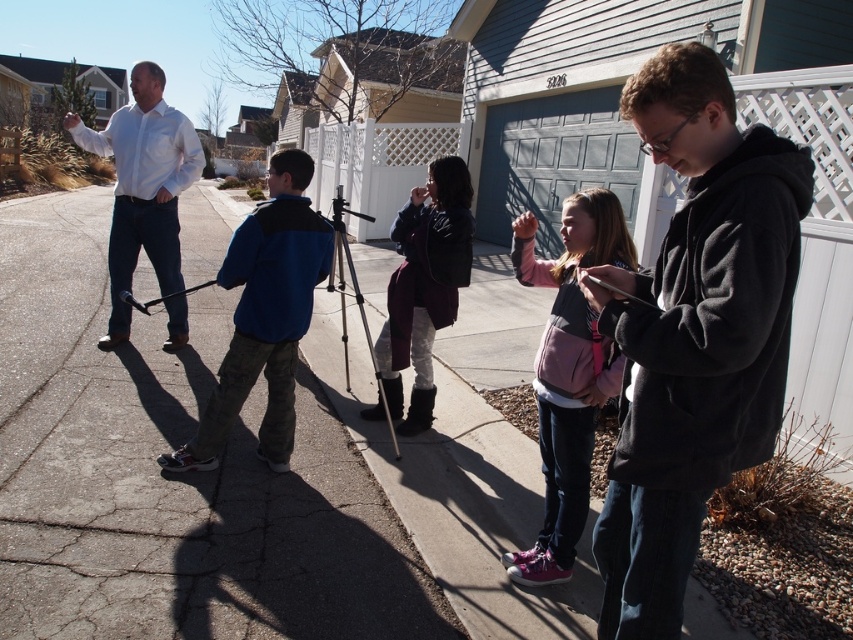
Is point (16, 352) more distant than point (598, 620)?

Yes, it is behind point (598, 620).

Does concrete sidewalk at center appear on the left side of dark gray fleece jacket at center right?

Yes, concrete sidewalk at center is to the left of dark gray fleece jacket at center right.

Is point (94, 378) less distant than point (740, 358)?

No, it is not.

You are a GUI agent. You are given a task and a screenshot of the screen. Output one action in this format:
    pyautogui.click(x=<x>, y=<y>)
    Task: Click on the concrete sidewalk at center
    
    Given the screenshot: What is the action you would take?
    pyautogui.click(x=170, y=477)

Is concrete sidewalk at center positioned at the back of camouflage pants at left?

That is False.

Who is more forward, (132, 568) or (265, 336)?

Positioned in front is point (132, 568).

Locate an element on the screen. The image size is (853, 640). concrete sidewalk at center is located at coordinates (170, 477).

Looking at this image, between concrete sidewalk at center and pink fleece jacket at center, which one is positioned higher?

Positioned higher is concrete sidewalk at center.

Who is lower down, concrete sidewalk at center or pink fleece jacket at center?

Positioned lower is pink fleece jacket at center.

Which is behind, point (128, 374) or point (595, 234)?

The point (128, 374) is more distant.

You are a GUI agent. You are given a task and a screenshot of the screen. Output one action in this format:
    pyautogui.click(x=<x>, y=<y>)
    Task: Click on the concrete sidewalk at center
    
    Given the screenshot: What is the action you would take?
    pyautogui.click(x=170, y=477)